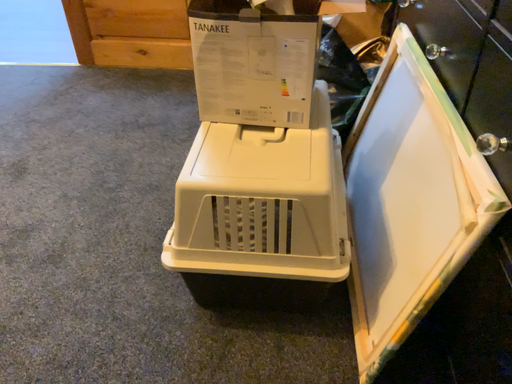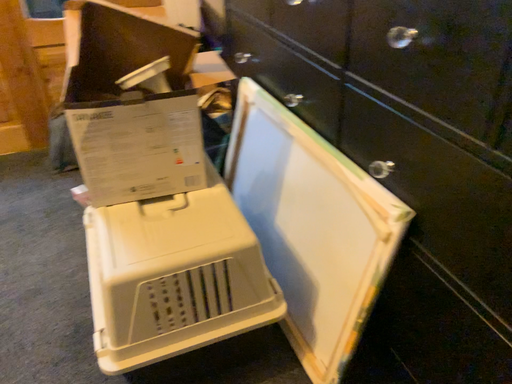
Question: Which way did the camera rotate in the video?

Choices:
 (A) rotated downward
 (B) rotated upward

Answer: (B)